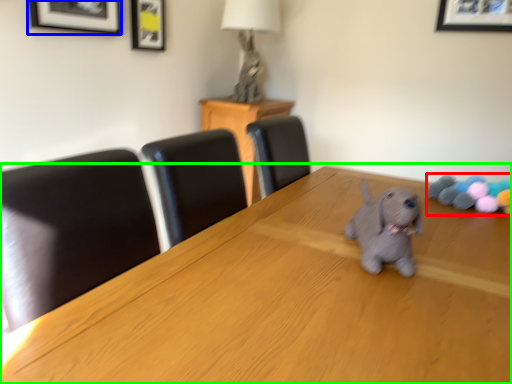
Question: Which object is positioned closest to toy (highlighted by a red box)? Select from picture frame (highlighted by a blue box) and table (highlighted by a green box).

Choices:
 (A) picture frame
 (B) table

Answer: (B)